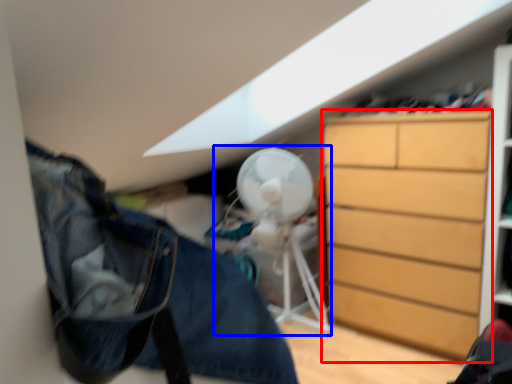
Question: Which object appears farthest to the camera in this image, chest of drawers (highlighted by a red box) or mechanical fan (highlighted by a blue box)?

Choices:
 (A) chest of drawers
 (B) mechanical fan

Answer: (B)